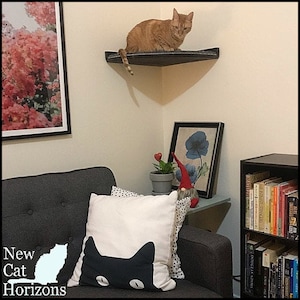
This screenshot has width=300, height=300. I want to click on bookshelf, so click(x=284, y=161).